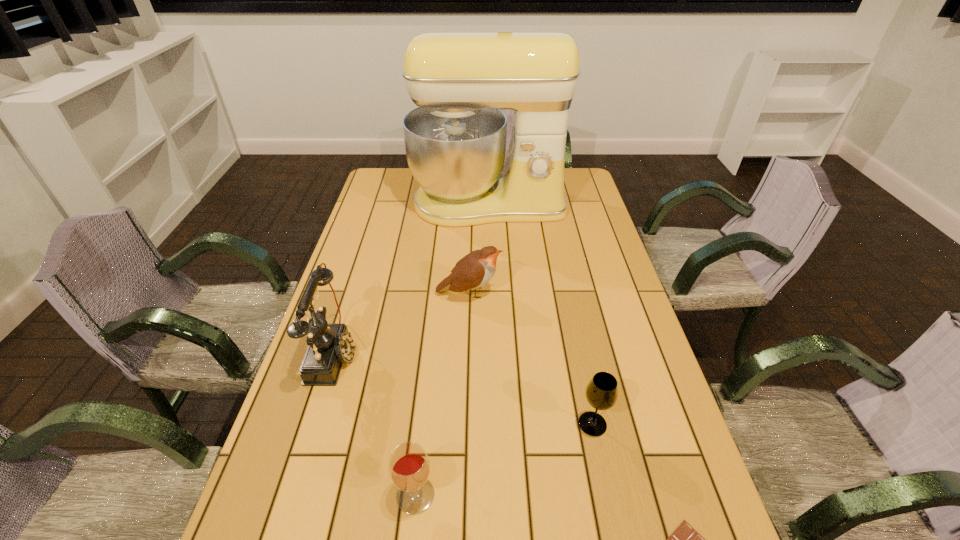
The image size is (960, 540). I want to click on blank space located 0.130m on the dial of the third farthest object, so click(x=406, y=353).

Locate an element on the screen. The width and height of the screenshot is (960, 540). vacant point located 0.270m at the face of the bird is located at coordinates (591, 293).

Where is `free space located 0.130m on the back of the right wineglass`? The image size is (960, 540). free space located 0.130m on the back of the right wineglass is located at coordinates (581, 366).

At what (x,y) coordinates should I click in order to perform the action: click on vacant space located on the right of the second nearest object. Please return your answer as a coordinate pair (x, y). Looking at the image, I should click on (599, 495).

At what (x,y) coordinates should I click in order to perform the action: click on object present at the far edge. Please return your answer as a coordinate pair (x, y). This screenshot has width=960, height=540. Looking at the image, I should click on (455, 141).

The image size is (960, 540). I want to click on object present at the left edge, so click(x=329, y=345).

Where is `mixer that is at the right edge`? The height and width of the screenshot is (540, 960). mixer that is at the right edge is located at coordinates (455, 141).

Identify the location of wineglass positioned at the right edge. 601,393.

The width and height of the screenshot is (960, 540). Identify the location of object located in the far right corner section of the desktop. (455, 141).

Find the location of `vacant region at the left edge of the desktop`. vacant region at the left edge of the desktop is located at coordinates (401, 213).